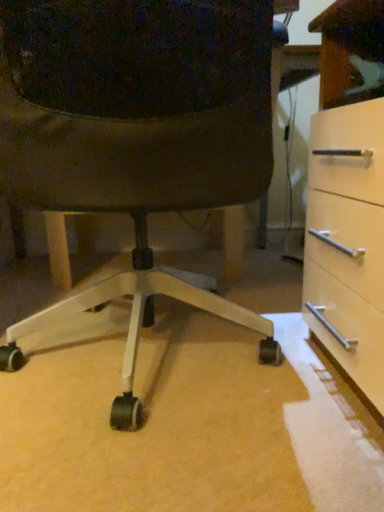
I want to click on matte black office chair at center, so click(136, 135).

Describe the element at coordinates (136, 135) in the screenshot. I see `matte black office chair at center` at that location.

Find the location of a particular element. The width and height of the screenshot is (384, 512). matte black office chair at center is located at coordinates pyautogui.click(x=136, y=135).